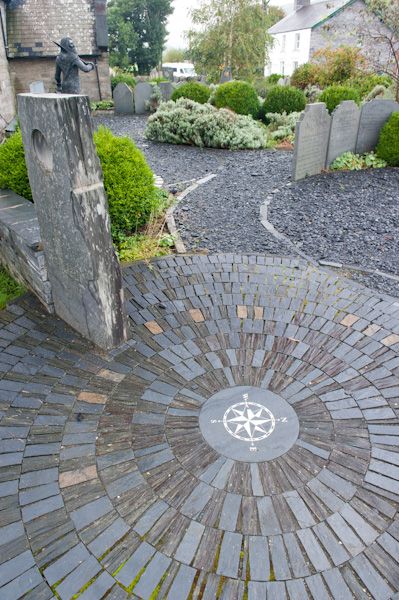
Find the location of a particular element. chimney is located at coordinates click(x=297, y=2).